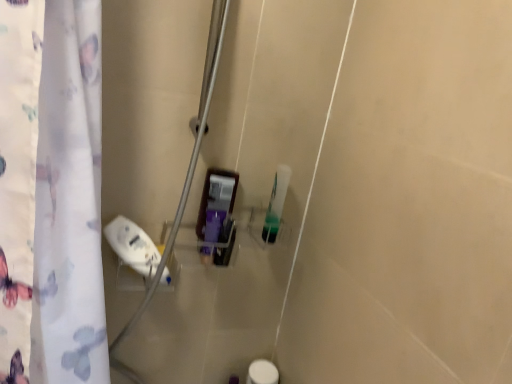
Question: Which direction should I rotate to look at green translucent bottle at center, the 1th toiletry from the back, — up or down?

Choices:
 (A) up
 (B) down

Answer: (B)

Question: Is translucent plastic container at center, which is counted as the 1th toiletry, starting from the left, bigger than green translucent bottle at center, the 1th toiletry from the back?

Choices:
 (A) yes
 (B) no

Answer: (A)

Question: Is translucent plastic container at center, the first toiletry viewed from the front, closer to camera compared to green translucent bottle at center, the 1th toiletry from the back?

Choices:
 (A) no
 (B) yes

Answer: (B)

Question: Does translucent plastic container at center, the 2th toiletry when ordered from right to left, have a lesser height compared to green translucent bottle at center, the 2th toiletry positioned from the front?

Choices:
 (A) yes
 (B) no

Answer: (A)

Question: Is translucent plastic container at center, the first toiletry viewed from the front, thinner than green translucent bottle at center, the 2th toiletry from the left?

Choices:
 (A) yes
 (B) no

Answer: (B)

Question: Can you confirm if translucent plastic container at center, arranged as the 2th toiletry when viewed from the back, is positioned to the right of green translucent bottle at center, the 2th toiletry positioned from the front?

Choices:
 (A) yes
 (B) no

Answer: (B)

Question: Are translucent plastic container at center, the first toiletry viewed from the front, and green translucent bottle at center, the 2th toiletry from the left, located far from each other?

Choices:
 (A) no
 (B) yes

Answer: (A)

Question: Does green translucent bottle at center, the 1th toiletry from the back, contain translucent plastic container at center, arranged as the 2th toiletry when viewed from the back?

Choices:
 (A) yes
 (B) no

Answer: (B)

Question: From a real-world perspective, is green translucent bottle at center, which is counted as the 1th toiletry, starting from the right, physically above translucent plastic container at center, arranged as the 2th toiletry when viewed from the back?

Choices:
 (A) yes
 (B) no

Answer: (A)

Question: Does green translucent bottle at center, the 2th toiletry from the left, have a lesser width compared to translucent plastic container at center, the first toiletry viewed from the front?

Choices:
 (A) no
 (B) yes

Answer: (B)

Question: Can you confirm if green translucent bottle at center, which is counted as the 1th toiletry, starting from the right, is positioned to the right of translucent plastic container at center, the 2th toiletry when ordered from right to left?

Choices:
 (A) no
 (B) yes

Answer: (B)

Question: From a real-world perspective, is green translucent bottle at center, the 2th toiletry from the left, below translucent plastic container at center, the first toiletry viewed from the front?

Choices:
 (A) no
 (B) yes

Answer: (A)

Question: Considering the relative positions of green translucent bottle at center, which is counted as the 1th toiletry, starting from the right, and translucent plastic container at center, the 2th toiletry when ordered from right to left, in the image provided, is green translucent bottle at center, which is counted as the 1th toiletry, starting from the right, in front of translucent plastic container at center, the 2th toiletry when ordered from right to left,?

Choices:
 (A) no
 (B) yes

Answer: (A)

Question: Is point (206, 251) positioned closer to the camera than point (281, 175)?

Choices:
 (A) farther
 (B) closer

Answer: (B)